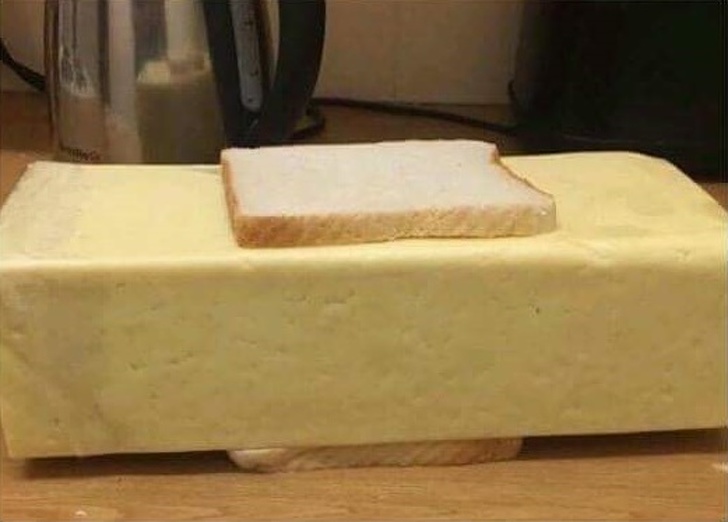
In order to click on floor in this screenshot , I will do `click(360, 121)`, `click(19, 139)`.